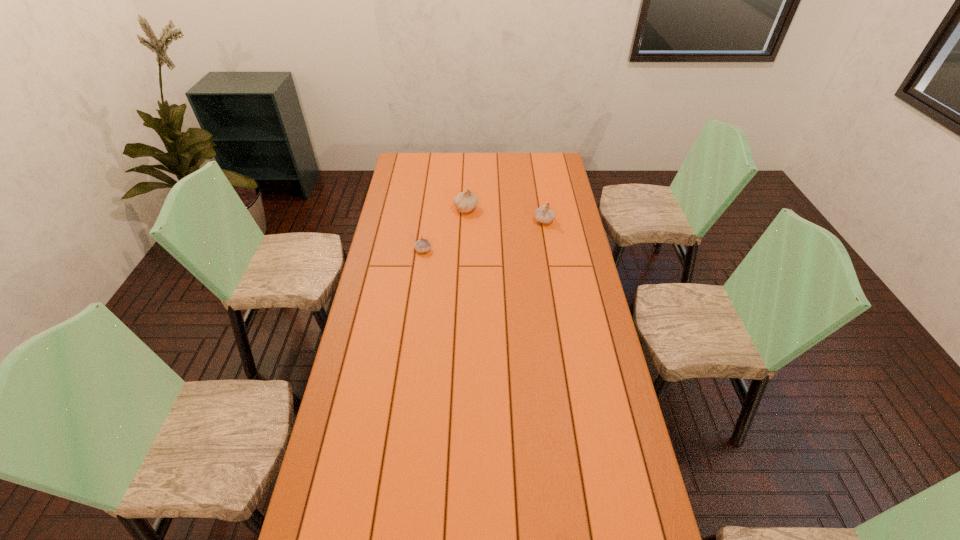
The width and height of the screenshot is (960, 540). In order to click on garlic that stands as the second closest to the second object from left to right in this screenshot , I will do `click(543, 214)`.